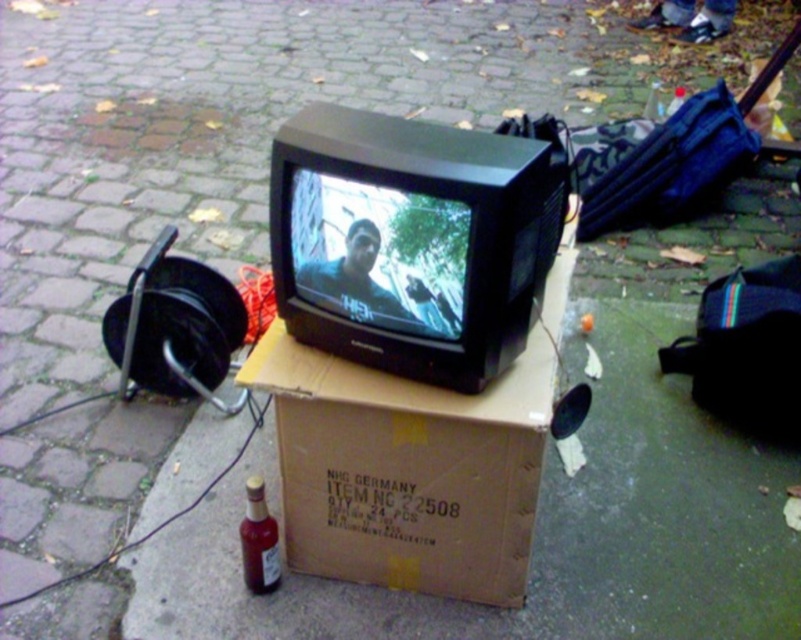
You are a delivery person who needs to place a new item on the brown cardboard box at center. However, you notice the translucent amber glass bottle at lower left nearby. Based on their positions, can you safely place the item on the box without moving the bottle?

The brown cardboard box at center is in front of the translucent amber glass bottle at lower left, meaning the box is closer to you than the bottle. Since the bottle is behind the box, placing the item on the box won not disturb the bottle.

In the scene shown: You are setting up a display in a public area. You have a brown cardboard box at center and a translucent amber glass bottle at lower left. Which object has a greater width?

The brown cardboard box at center has a greater width than the translucent amber glass bottle at lower left.

You are a delivery person who needs to place a fragile item on the brown cardboard box at center. However, there is a translucent amber glass bottle at lower left underneath it. Is the bottle safely placed so that the box won

The brown cardboard box at center is positioned over the translucent amber glass bottle at lower left, which means the bottle is not safely placed because the box is directly above it and could crush the bottle if anything is placed on top.